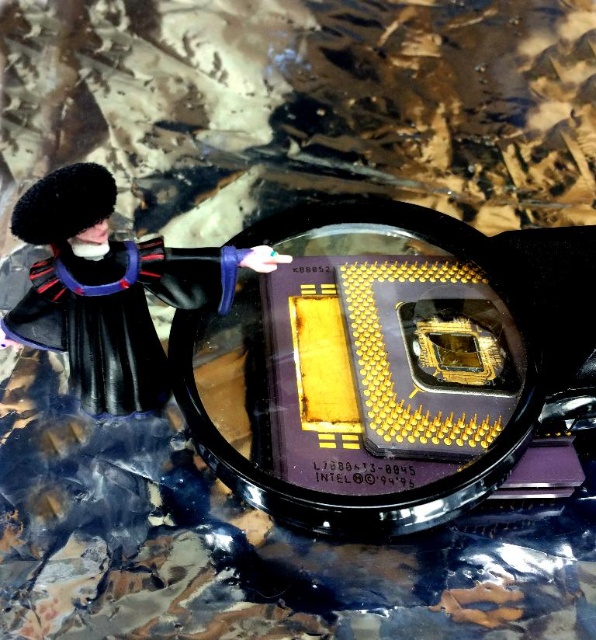
Which is above, black plastic magnifying glass at center or black matte toy at left?

Positioned higher is black matte toy at left.

Does black plastic magnifying glass at center appear on the right side of black matte toy at left?

Indeed, black plastic magnifying glass at center is positioned on the right side of black matte toy at left.

Locate an element on the screen. This screenshot has width=596, height=640. black plastic magnifying glass at center is located at coordinates (390, 364).